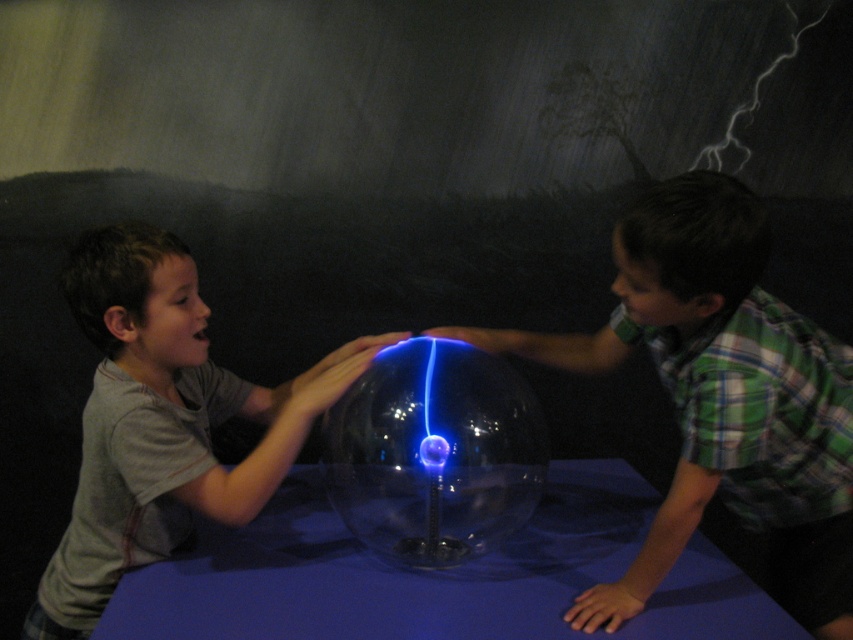
You are standing in front of the Van de Graaff generator and see two points on the sphere. Which point is closer to you, point (x=357, y=636) or point (x=523, y=484)?

Point (x=357, y=636) is closer to the viewer than point (x=523, y=484).

You are standing in front of the Van de Graaff generator sphere. There are two points marked on the sphere. Which point is closer to you, point [323,525] or point [160,483]?

Point [323,525] is further to the viewer than point [160,483], so the closer point is point [160,483].

You are a scientist setting up an experiment with a Van de Graaff generator. You need to place the generator on the blue fabric table at center. According to the coordinates provided, where exactly should you position the generator on the table?

The blue fabric table at center should have the generator positioned at point (438,577) as specified in the coordinates provided.